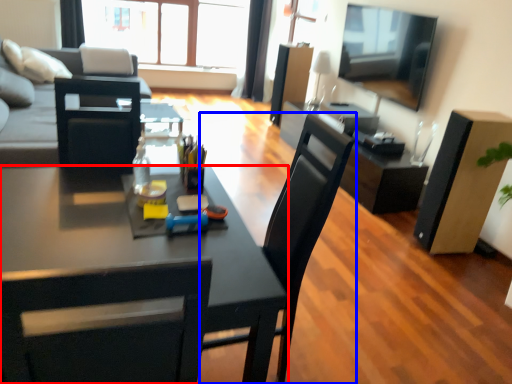
Question: Among these objects, which one is farthest to the camera, desk (highlighted by a red box) or chair (highlighted by a blue box)?

Choices:
 (A) desk
 (B) chair

Answer: (B)